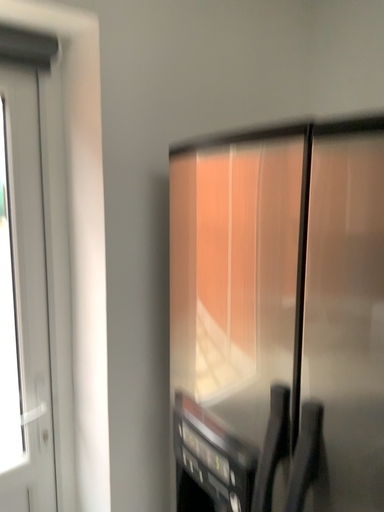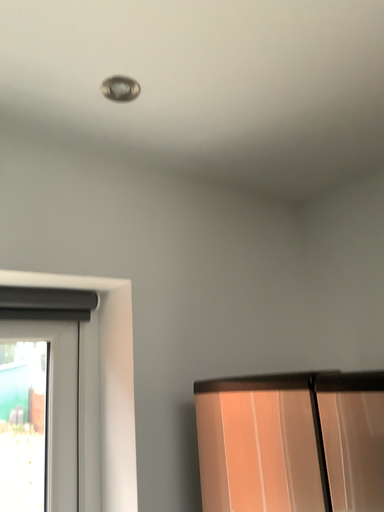
Question: How did the camera likely rotate when shooting the video?

Choices:
 (A) rotated downward
 (B) rotated upward

Answer: (B)